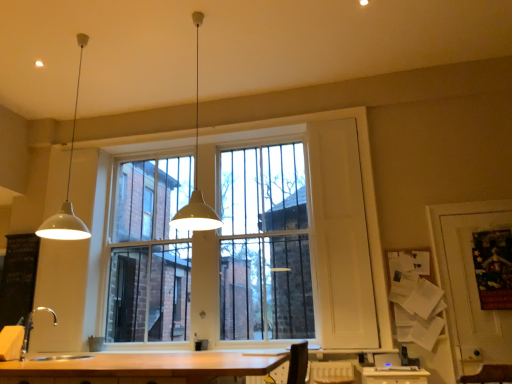
Question: Which is correct: white matte pendant light at upper left, which is counted as the first lamp, starting from the left, is inside silver metallic faucet at lower left, or outside of it?

Choices:
 (A) outside
 (B) inside

Answer: (A)

Question: In terms of height, does white matte pendant light at upper left, which is counted as the first lamp, starting from the left, look taller or shorter compared to silver metallic faucet at lower left?

Choices:
 (A) tall
 (B) short

Answer: (A)

Question: Estimate the real-world distances between objects in this image. Which object is farther from the silver metallic faucet at lower left?

Choices:
 (A) white glass window at center
 (B) black chalkboard at left
 (C) white matte pendant light at upper left, placed as the 2th lamp when sorted from right to left
 (D) white matte pendant light at center, marked as the first lamp in a right-to-left arrangement

Answer: (A)

Question: Which of these objects is positioned closest to the silver metallic faucet at lower left?

Choices:
 (A) white matte pendant light at center, the second lamp in the left-to-right sequence
 (B) white glass window at center
 (C) white matte pendant light at upper left, which is counted as the first lamp, starting from the left
 (D) black chalkboard at left

Answer: (D)